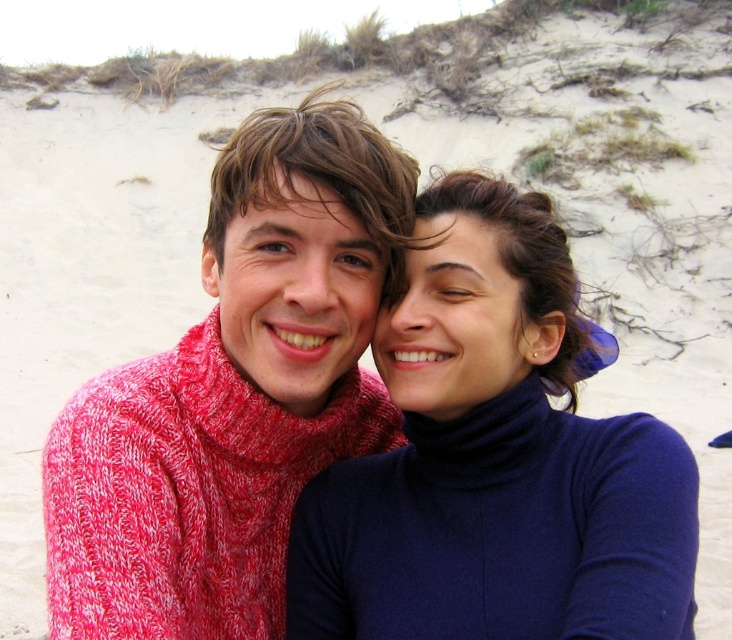
Between point (493, 339) and point (264, 417), which one is positioned behind?

The point (264, 417) is behind.

Who is more forward, (429, 362) or (302, 115)?

Point (429, 362)

Describe the element at coordinates (496, 461) in the screenshot. The image size is (732, 640). I see `matte blue turtleneck at center` at that location.

At what (x,y) coordinates should I click in order to perform the action: click on matte blue turtleneck at center. Please return your answer as a coordinate pair (x, y). The image size is (732, 640). Looking at the image, I should click on (496, 461).